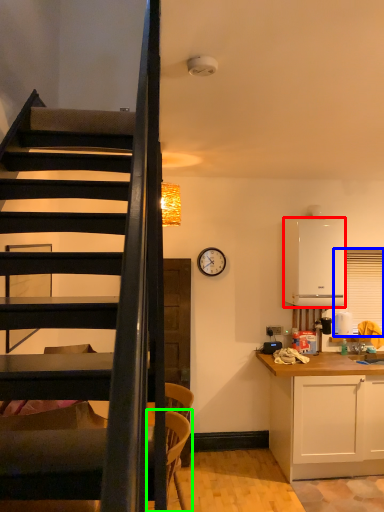
Question: Considering the real-world distances, which object is closest to appliance (highlighted by a red box)? window screen (highlighted by a blue box) or armchair (highlighted by a green box).

Choices:
 (A) window screen
 (B) armchair

Answer: (A)